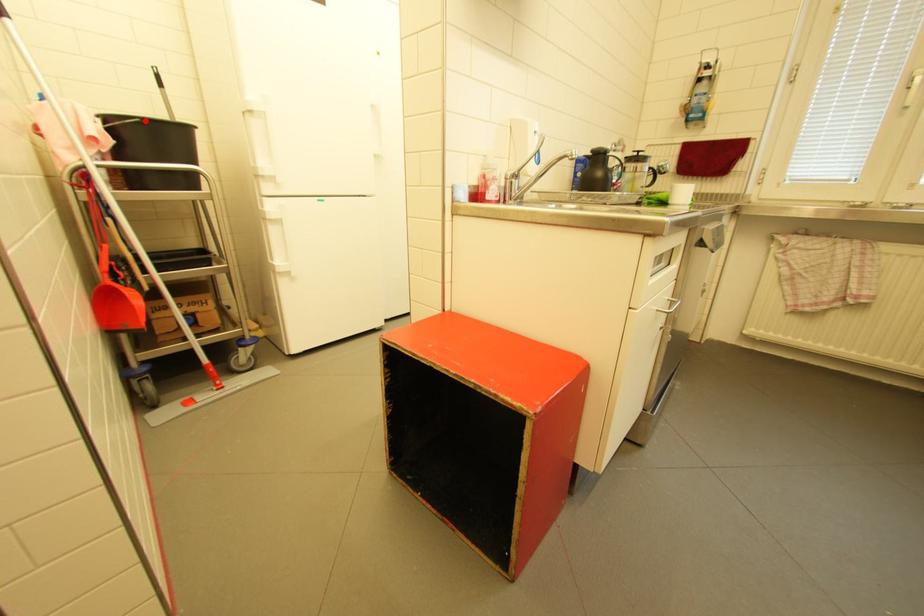
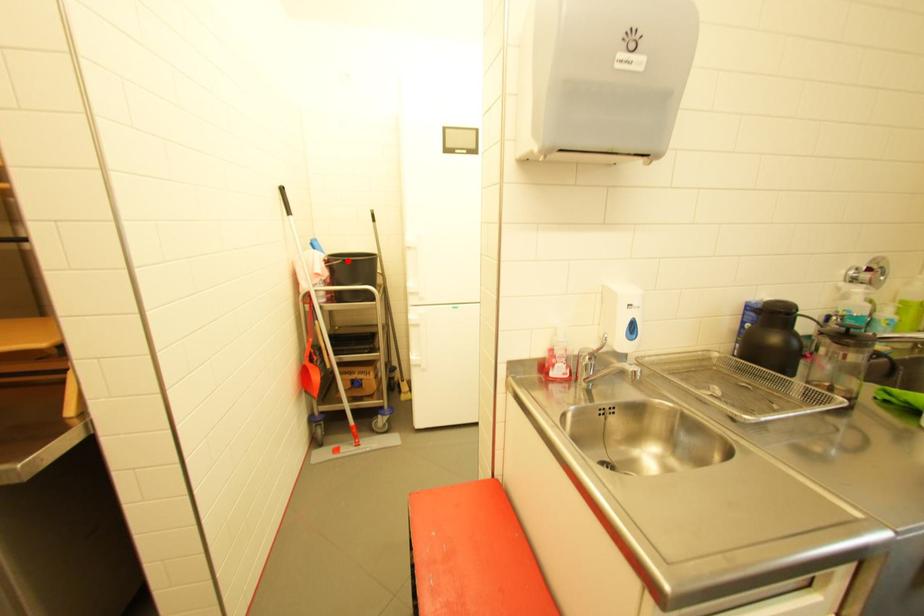
I am providing you with two images of the same scene from different viewpoints. A red point is marked on the first image and another point is marked on the second image. Are the points marked in image1 and image2 representing the same 3D position?

Yes